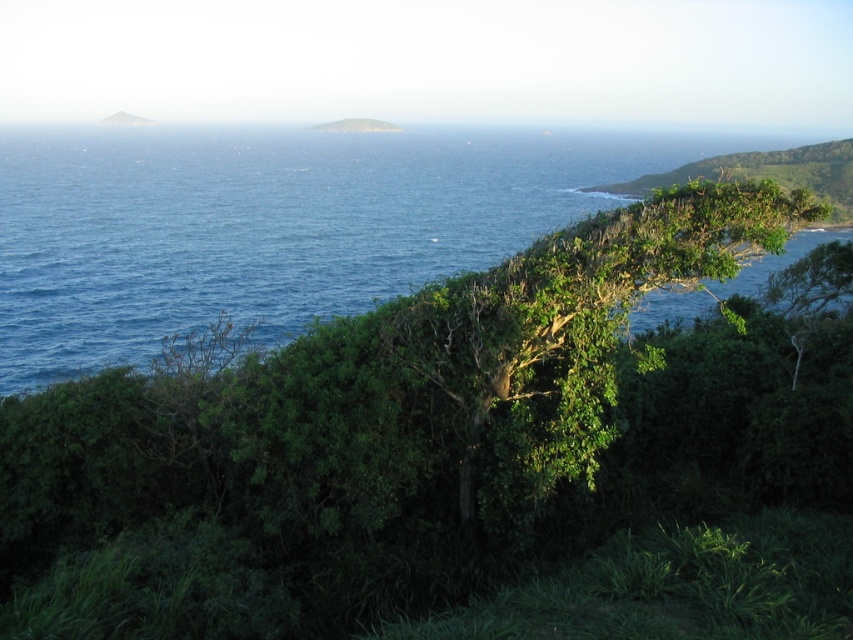
You are a hiker planning to take a trail that starts at the green leafy hillside at upper center and wants to reach the green leafy hillside at upper right. Based on the scene, which direction should you head to descend towards the lower area?

The green leafy hillside at upper right is located below the green leafy hillside at upper center, so you should head downward from the green leafy hillside at upper center towards the green leafy hillside at upper right to reach the lower area.

You are standing at the camera position looking at the coastal landscape. There is a point marked at coordinates point (136, 164). Can you estimate how far this point is from your current position?

The point (136, 164) is 309.44 meters away from the camera, so the distance from your current position to the point is 309.44 meters.